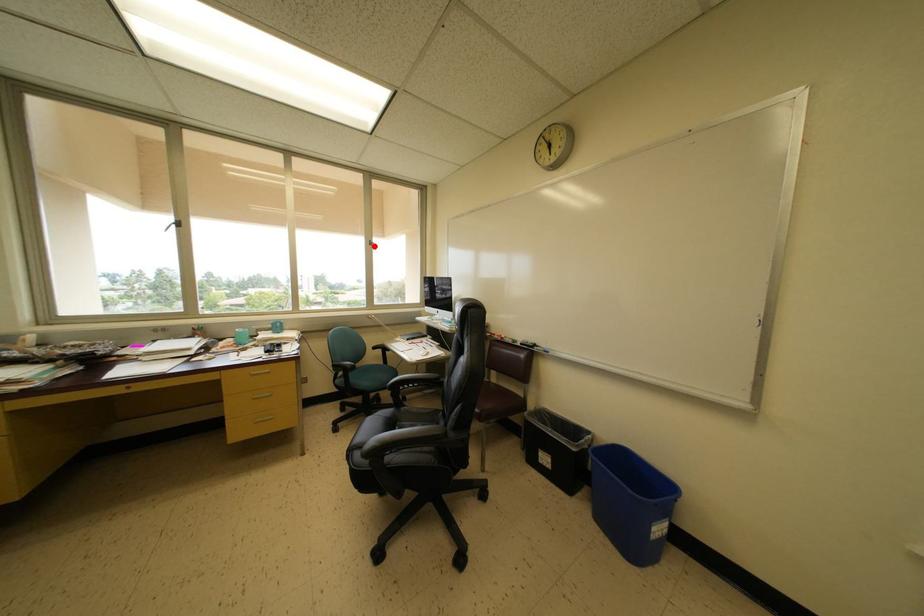
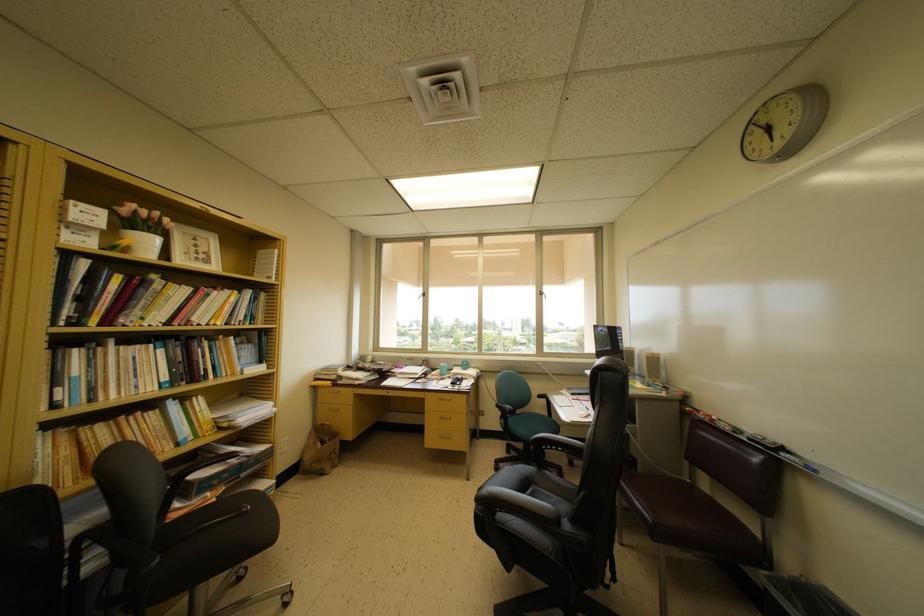
The point at the highlighted location is marked in the first image. Where is the corresponding point in the second image?

(543, 297)